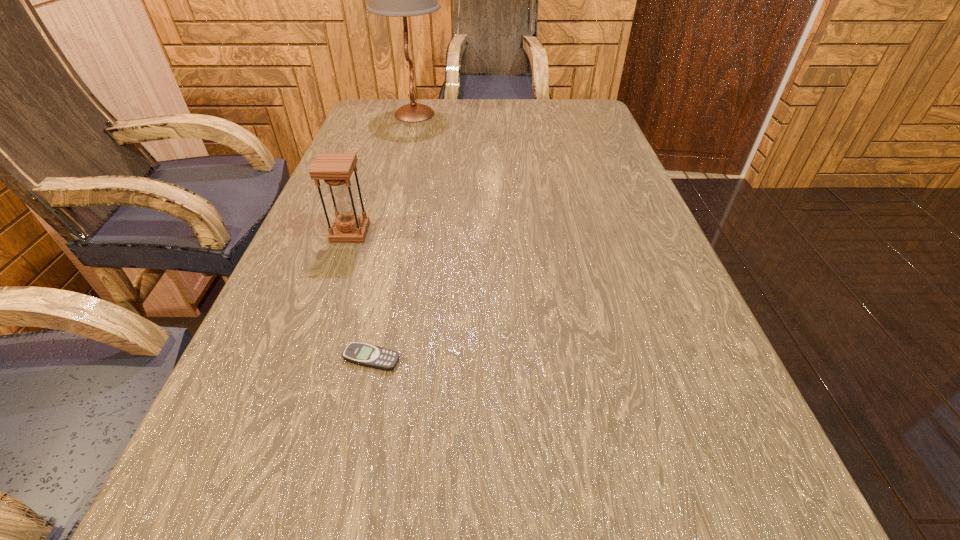
Point out which object is positioned as the second nearest to the shortest object. Please provide its 2D coordinates. Your answer should be formatted as a tuple, i.e. [(x, y)], where the tuple contains the x and y coordinates of a point satisfying the conditions above.

[(403, 0)]

The width and height of the screenshot is (960, 540). I want to click on vacant space that satisfies the following two spatial constraints: 1. on the front-facing side of the farthest object; 2. on the right side of the shortest object, so click(350, 359).

Identify the location of vacant position in the image that satisfies the following two spatial constraints: 1. on the front-facing side of the farthest object; 2. on the left side of the nearest object. This screenshot has height=540, width=960. (350, 359).

Locate an element on the screen. This screenshot has height=540, width=960. free spot that satisfies the following two spatial constraints: 1. on the front-facing side of the shortest object; 2. on the left side of the tallest object is located at coordinates (350, 359).

Locate an element on the screen. free spot that satisfies the following two spatial constraints: 1. on the front side of the second tallest object; 2. on the right side of the nearest object is located at coordinates (306, 359).

Find the location of `free space that satisfies the following two spatial constraints: 1. on the front-facing side of the farthest object; 2. on the back side of the nearest object`. free space that satisfies the following two spatial constraints: 1. on the front-facing side of the farthest object; 2. on the back side of the nearest object is located at coordinates (350, 359).

The width and height of the screenshot is (960, 540). Find the location of `vacant position in the image that satisfies the following two spatial constraints: 1. on the back side of the nearest object; 2. on the front-facing side of the tallest object`. vacant position in the image that satisfies the following two spatial constraints: 1. on the back side of the nearest object; 2. on the front-facing side of the tallest object is located at coordinates (425, 114).

You are a GUI agent. You are given a task and a screenshot of the screen. Output one action in this format:
    pyautogui.click(x=<x>, y=<y>)
    Task: Click on the vacant space that satisfies the following two spatial constraints: 1. on the front-facing side of the table lamp; 2. on the back side of the nearest object
    This screenshot has width=960, height=540.
    Given the screenshot: What is the action you would take?
    pyautogui.click(x=350, y=359)

At what (x,y) coordinates should I click in order to perform the action: click on vacant space that satisfies the following two spatial constraints: 1. on the front-facing side of the shortest object; 2. on the left side of the farthest object. Please return your answer as a coordinate pair (x, y). Looking at the image, I should click on (350, 359).